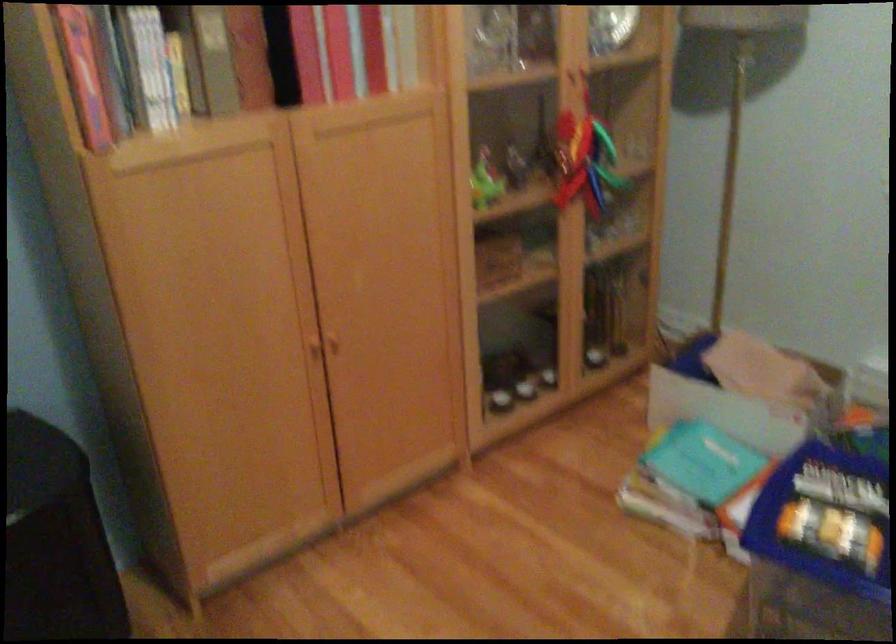
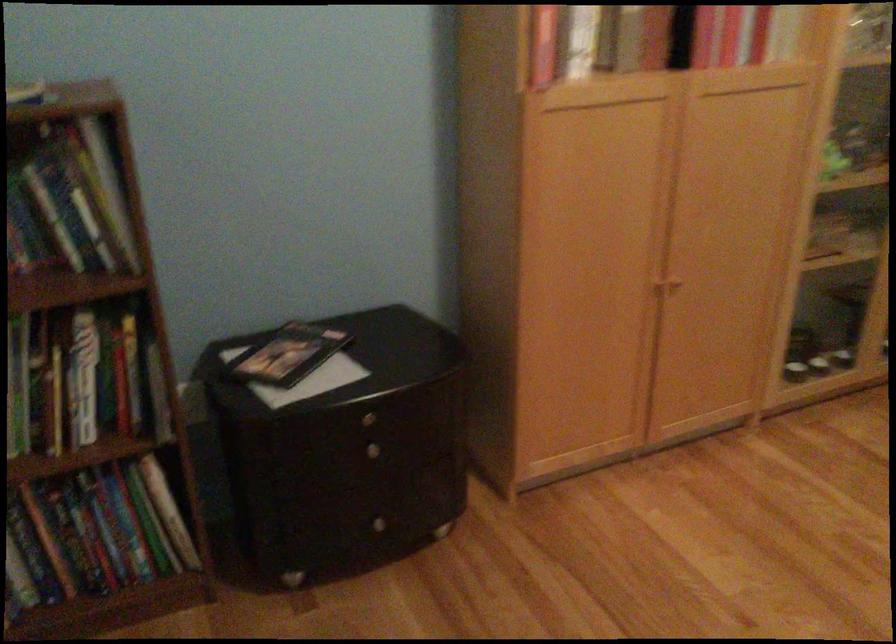
Locate, in the second image, the point that corresponds to pixel 314 350 in the first image.

(653, 287)